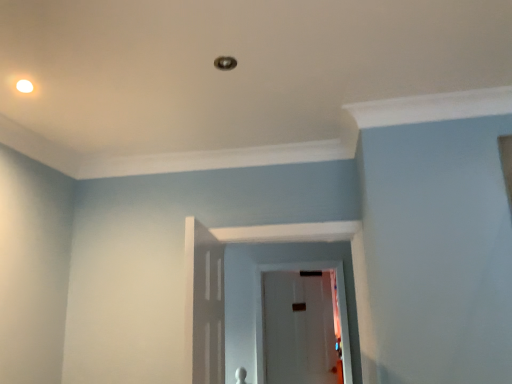
Question: Considering the relative sizes of white glossy light fixture at upper left and transparent glass door at center in the image provided, is white glossy light fixture at upper left smaller than transparent glass door at center?

Choices:
 (A) yes
 (B) no

Answer: (A)

Question: Is white glossy light fixture at upper left far from transparent glass door at center?

Choices:
 (A) yes
 (B) no

Answer: (A)

Question: Is white glossy light fixture at upper left at the left side of transparent glass door at center?

Choices:
 (A) yes
 (B) no

Answer: (A)

Question: Does white glossy light fixture at upper left turn towards transparent glass door at center?

Choices:
 (A) no
 (B) yes

Answer: (A)

Question: Does white glossy light fixture at upper left have a greater height compared to transparent glass door at center?

Choices:
 (A) no
 (B) yes

Answer: (A)

Question: Is white glossy light fixture at upper left to the right of transparent glass door at center from the viewer's perspective?

Choices:
 (A) no
 (B) yes

Answer: (A)

Question: From the image's perspective, is transparent glass door at center located beneath white glossy light fixture at upper left?

Choices:
 (A) no
 (B) yes

Answer: (B)

Question: Is transparent glass door at center to the left of white glossy light fixture at upper left from the viewer's perspective?

Choices:
 (A) no
 (B) yes

Answer: (A)

Question: From a real-world perspective, is transparent glass door at center located higher than white glossy light fixture at upper left?

Choices:
 (A) no
 (B) yes

Answer: (A)

Question: Is transparent glass door at center positioned with its back to white glossy light fixture at upper left?

Choices:
 (A) yes
 (B) no

Answer: (B)

Question: Can you confirm if transparent glass door at center is wider than white glossy light fixture at upper left?

Choices:
 (A) yes
 (B) no

Answer: (B)

Question: Is white glossy light fixture at upper left inside transparent glass door at center?

Choices:
 (A) yes
 (B) no

Answer: (B)

Question: Considering the positions of point (19, 91) and point (258, 284), is point (19, 91) closer or farther from the camera than point (258, 284)?

Choices:
 (A) closer
 (B) farther

Answer: (A)